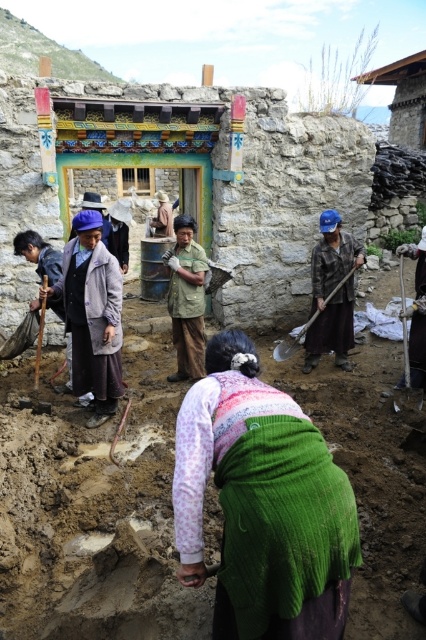
You are a worker at the construction site near the traditional stone building with a colorful doorway. You need to place a new stone exactly where the brown clay at center is located. Where should you place the stone relative to the doorway?

The brown clay at center is located at coordinates point (91,513) relative to the doorway. Since the doorway is the main entrance, you should place the new stone at that specific coordinate point near the doorway.

Looking at this image, you are a construction worker at the site and need to place a new decorative stone above the doorway. You have the brown clay at center and the dark brown wooden stick at left. Which object should you use to support the stone if you want it to be placed above the doorway?

The dark brown wooden stick at left should be used to support the stone since the brown clay at center is located below it, making the stick a better choice for an elevated position.